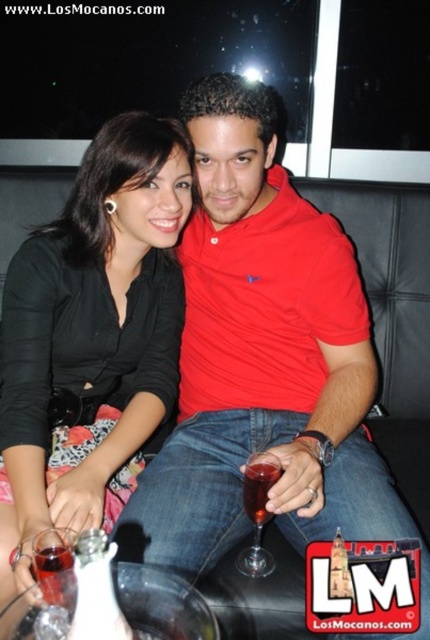
Which is behind, point (353, 532) or point (249, 484)?

The point (353, 532) is more distant.

Between red cotton polo shirt at center and translucent glass wine at center, which one has more height?

With more height is red cotton polo shirt at center.

Between point (180, 259) and point (267, 488), which one is positioned in front?

Point (267, 488)

This screenshot has height=640, width=430. Find the location of `red cotton polo shirt at center`. red cotton polo shirt at center is located at coordinates (261, 356).

Does matte black shirt at center have a greater width compared to translucent glass wine at center?

Indeed, matte black shirt at center has a greater width compared to translucent glass wine at center.

Does matte black shirt at center have a larger size compared to translucent glass wine at center?

Yes, matte black shirt at center is bigger than translucent glass wine at center.

Between point (159, 280) and point (266, 513), which one is positioned behind?

The point (159, 280) is more distant.

At what (x,y) coordinates should I click in order to perform the action: click on matte black shirt at center. Please return your answer as a coordinate pair (x, y). The height and width of the screenshot is (640, 430). Looking at the image, I should click on (92, 326).

Who is higher up, translucent glass wine glass at center or translucent glass at lower left?

translucent glass wine glass at center is above.

Between point (264, 464) and point (54, 592), which one is positioned in front?

Point (54, 592) is more forward.

Is point (249, 502) positioned after point (64, 544)?

Yes, it is.

Locate an element on the screen. The image size is (430, 640). translucent glass wine glass at center is located at coordinates (258, 512).